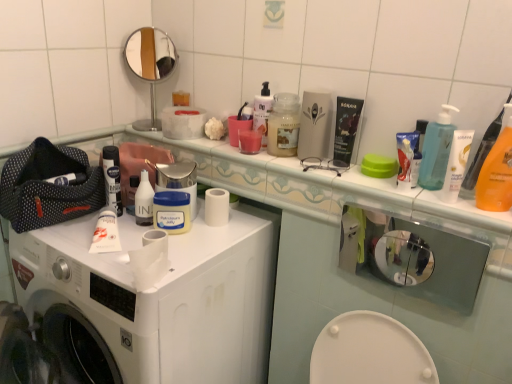
The width and height of the screenshot is (512, 384). I want to click on free space that is to the left of white matte toilet paper at center, so click(x=95, y=259).